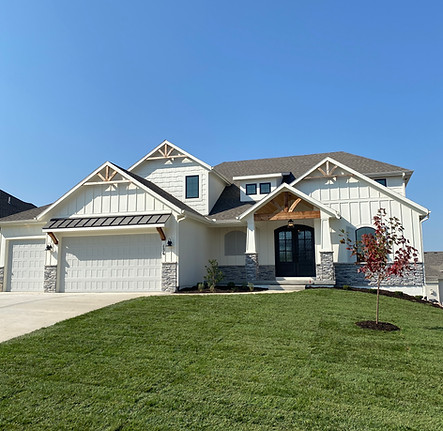
Find the location of `wall`. wall is located at coordinates [x=192, y=217].